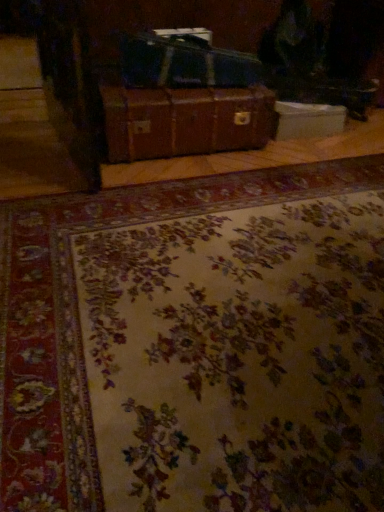
Locate an element on the screen. The image size is (384, 512). brown leather suitcase at center is located at coordinates (185, 121).

Describe the element at coordinates (308, 120) in the screenshot. I see `white cardboard box at center` at that location.

Locate an element on the screen. This screenshot has height=512, width=384. shiny black suitcase at center is located at coordinates (184, 63).

Is white cardboard box at center taller or shorter than shiny black suitcase at center?

In the image, white cardboard box at center appears to be shorter than shiny black suitcase at center.

Is white cardboard box at center next to shiny black suitcase at center and touching it?

No, white cardboard box at center is not next to shiny black suitcase at center.

From the image's perspective, is white cardboard box at center below shiny black suitcase at center?

Yes.

Who is bigger, shiny black suitcase at center or floral-patterned carpet at center?

floral-patterned carpet at center.

Is shiny black suitcase at center at the right side of floral-patterned carpet at center?

Incorrect, shiny black suitcase at center is not on the right side of floral-patterned carpet at center.

In the scene shown: Does shiny black suitcase at center turn towards floral-patterned carpet at center?

No, shiny black suitcase at center does not turn towards floral-patterned carpet at center.

Who is taller, white cardboard box at center or brown leather suitcase at center?

brown leather suitcase at center.

Is white cardboard box at center inside the boundaries of brown leather suitcase at center, or outside?

white cardboard box at center is spatially situated outside brown leather suitcase at center.

Based on the photo, is white cardboard box at center touching brown leather suitcase at center?

white cardboard box at center and brown leather suitcase at center are clearly separated.

In the scene shown: Based on their positions, is white cardboard box at center located to the left or right of brown leather suitcase at center?

white cardboard box at center is positioned on brown leather suitcase at center's right side.

Considering the relative sizes of brown leather suitcase at center and white cardboard box at center in the image provided, is brown leather suitcase at center taller than white cardboard box at center?

Yes.

How many degrees apart are the facing directions of brown leather suitcase at center and white cardboard box at center?

They differ by 1.61 degrees in their facing directions.

Based on the photo, from the image's perspective, between brown leather suitcase at center and white cardboard box at center, who is located below?

brown leather suitcase at center is shown below in the image.

How distant is white cardboard box at center from floral-patterned carpet at center?

1.34 meters.

Which object is closer to the camera taking this photo, white cardboard box at center or floral-patterned carpet at center?

floral-patterned carpet at center is closer to the camera.

Considering the positions of point (314, 116) and point (284, 438), is point (314, 116) closer or farther from the camera than point (284, 438)?

Point (314, 116).

From the image's perspective, between white cardboard box at center and floral-patterned carpet at center, which one is located above?

From the image's view, white cardboard box at center is above.

Can you see floral-patterned carpet at center touching brown leather suitcase at center?

floral-patterned carpet at center and brown leather suitcase at center are not in contact.

Which is farther from the camera, (x=96, y=436) or (x=116, y=104)?

The point (x=116, y=104) is behind.

From the image's perspective, between floral-patterned carpet at center and brown leather suitcase at center, who is located below?

floral-patterned carpet at center appears lower in the image.

In the scene shown: Which of these two, floral-patterned carpet at center or brown leather suitcase at center, stands taller?

Standing taller between the two is brown leather suitcase at center.

How distant is shiny black suitcase at center from brown leather suitcase at center?

They are 6.95 inches apart.

How many degrees apart are the facing directions of shiny black suitcase at center and brown leather suitcase at center?

They differ by 8.04 degrees in their facing directions.

Does shiny black suitcase at center turn towards brown leather suitcase at center?

No, shiny black suitcase at center does not turn towards brown leather suitcase at center.

From a real-world perspective, between shiny black suitcase at center and brown leather suitcase at center, who is vertically higher?

shiny black suitcase at center.

I want to click on cardboard box lying behind the shiny black suitcase at center, so coord(308,120).

Where is `mat located on the right of shiny black suitcase at center`? The width and height of the screenshot is (384, 512). mat located on the right of shiny black suitcase at center is located at coordinates (196, 345).

From the image, which object appears to be farther from brown leather suitcase at center, white cardboard box at center or shiny black suitcase at center?

white cardboard box at center is positioned further to the anchor brown leather suitcase at center.

When comparing their distances from brown leather suitcase at center, does white cardboard box at center or floral-patterned carpet at center seem closer?

The object closer to brown leather suitcase at center is white cardboard box at center.

Which object lies nearer to the anchor point shiny black suitcase at center, brown leather suitcase at center or white cardboard box at center?

brown leather suitcase at center.

When comparing their distances from white cardboard box at center, does shiny black suitcase at center or floral-patterned carpet at center seem closer?

shiny black suitcase at center is closer to white cardboard box at center.

From the image, which object appears to be farther from brown leather suitcase at center, floral-patterned carpet at center or white cardboard box at center?

floral-patterned carpet at center is positioned further to the anchor brown leather suitcase at center.

From the image, which object appears to be nearer to brown leather suitcase at center, shiny black suitcase at center or white cardboard box at center?

shiny black suitcase at center is positioned closer to the anchor brown leather suitcase at center.

From the picture: Which object lies nearer to the anchor point floral-patterned carpet at center, brown leather suitcase at center or white cardboard box at center?

The object closer to floral-patterned carpet at center is brown leather suitcase at center.

When comparing their distances from brown leather suitcase at center, does floral-patterned carpet at center or shiny black suitcase at center seem further?

The object further to brown leather suitcase at center is floral-patterned carpet at center.

Locate an element on the screen. The height and width of the screenshot is (512, 384). suitcase located between floral-patterned carpet at center and white cardboard box at center in the depth direction is located at coordinates (185, 121).

This screenshot has width=384, height=512. I want to click on luggage situated between brown leather suitcase at center and white cardboard box at center from left to right, so pos(184,63).

Find the location of a particular element. luggage located between floral-patterned carpet at center and white cardboard box at center in the depth direction is located at coordinates (184, 63).

Find the location of a particular element. This screenshot has height=512, width=384. suitcase between floral-patterned carpet at center and shiny black suitcase at center in the front-back direction is located at coordinates (185, 121).